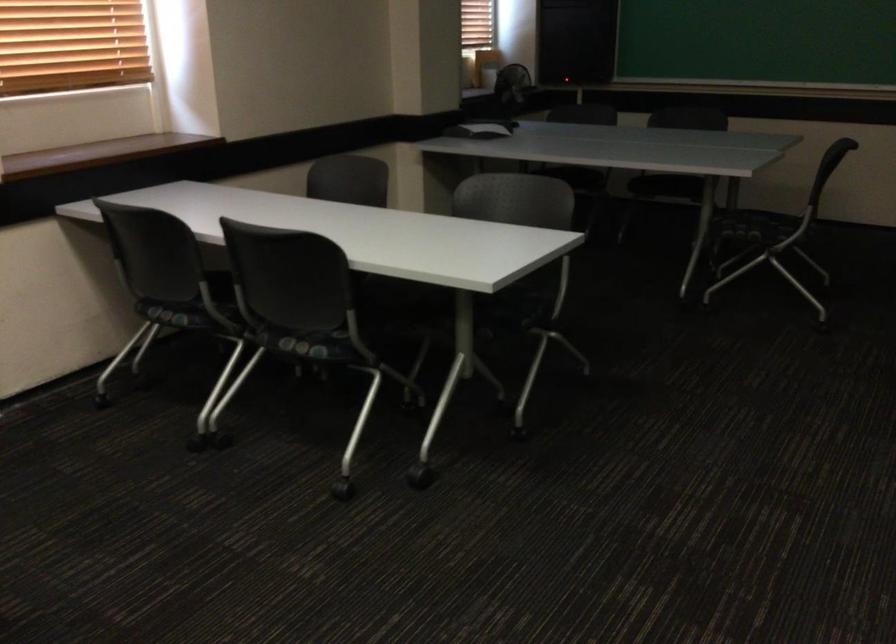
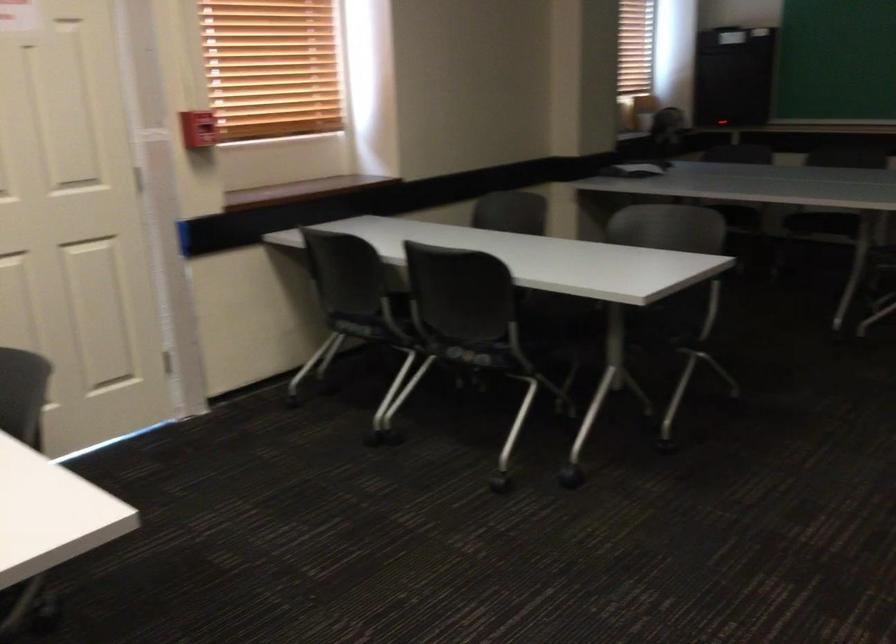
In the second image, find the point that corresponds to (x=507, y=321) in the first image.

(657, 337)